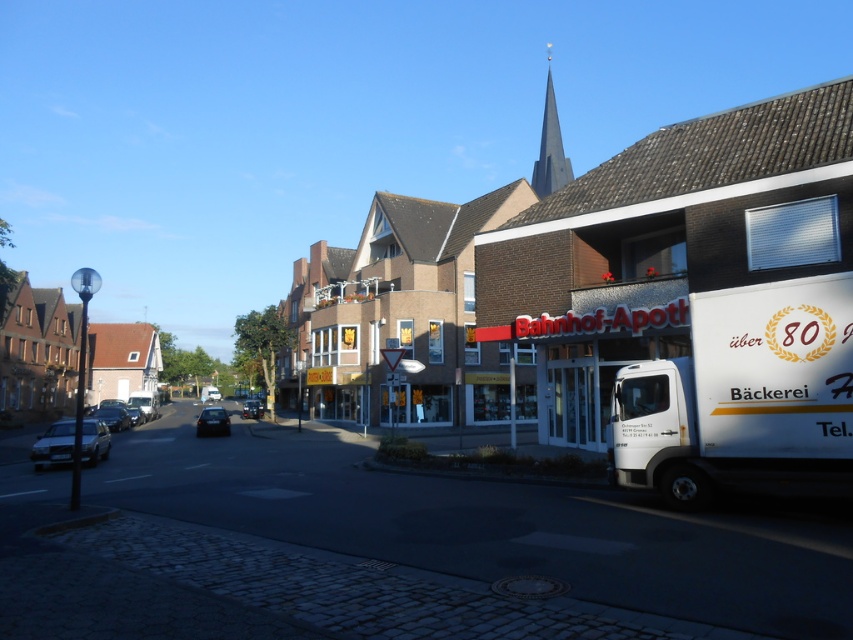
Question: Can you confirm if brown brick building at left is positioned to the left of shiny black car at left?

Choices:
 (A) yes
 (B) no

Answer: (A)

Question: Which of the following is the farthest from the observer?

Choices:
 (A) 132,416
 (B) 198,419
 (C) 61,426

Answer: (A)

Question: Which point is farther from the camera taking this photo?

Choices:
 (A) (109, 422)
 (B) (24, 339)

Answer: (B)

Question: Does white matte truck at right appear under silver metallic car at lower left?

Choices:
 (A) no
 (B) yes

Answer: (A)

Question: Can you confirm if silver metallic car at lower left is smaller than shiny black car at center?

Choices:
 (A) no
 (B) yes

Answer: (A)

Question: Which is farther from the white matte truck at right?

Choices:
 (A) brown brick building at left
 (B) dark gray stone spire at upper center
 (C) shiny black car at center

Answer: (A)